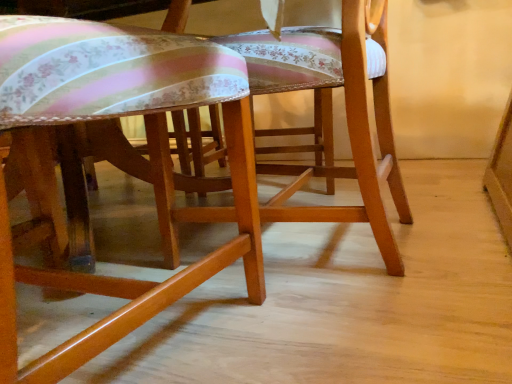
Question: Does point (112, 44) appear closer or farther from the camera than point (397, 175)?

Choices:
 (A) closer
 (B) farther

Answer: (A)

Question: From the image's perspective, relative to wooden chair at center, placed as the 1th chair when sorted from right to left, is matte wood chair at center, the 1th chair in the left-to-right sequence, above or below?

Choices:
 (A) above
 (B) below

Answer: (B)

Question: In terms of height, does matte wood chair at center, acting as the second chair starting from the right, look taller or shorter compared to wooden chair at center, the 2th chair when ordered from left to right?

Choices:
 (A) tall
 (B) short

Answer: (B)

Question: From a real-world perspective, relative to matte wood chair at center, acting as the second chair starting from the right, is wooden chair at center, placed as the 1th chair when sorted from right to left, vertically above or below?

Choices:
 (A) above
 (B) below

Answer: (B)

Question: From the image's perspective, is wooden chair at center, placed as the 1th chair when sorted from right to left, above or below matte wood chair at center, the 1th chair in the left-to-right sequence?

Choices:
 (A) above
 (B) below

Answer: (A)

Question: Is wooden chair at center, placed as the 1th chair when sorted from right to left, taller or shorter than matte wood chair at center, the 1th chair in the left-to-right sequence?

Choices:
 (A) tall
 (B) short

Answer: (A)

Question: Is wooden chair at center, placed as the 1th chair when sorted from right to left, wider or thinner than matte wood chair at center, acting as the second chair starting from the right?

Choices:
 (A) thin
 (B) wide

Answer: (A)